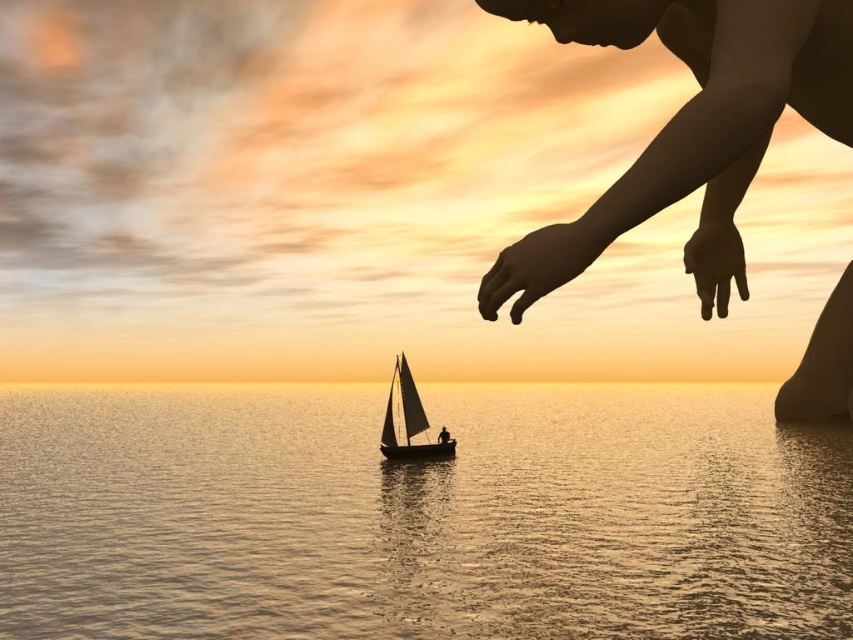
You are an observer standing on the shore looking at the seascape. You notice the silvery reflective water at center and the silhouette skin at upper right. Which object is located below the other?

The silvery reflective water at center is positioned under the silhouette skin at upper right, so the water is below the silhouette skin.

You are an observer looking at the seascape. You notice the silhouette skin at upper right and the silky white sail at center. Which object is positioned higher in the image?

The silhouette skin at upper right is positioned higher in the image than the silky white sail at center.